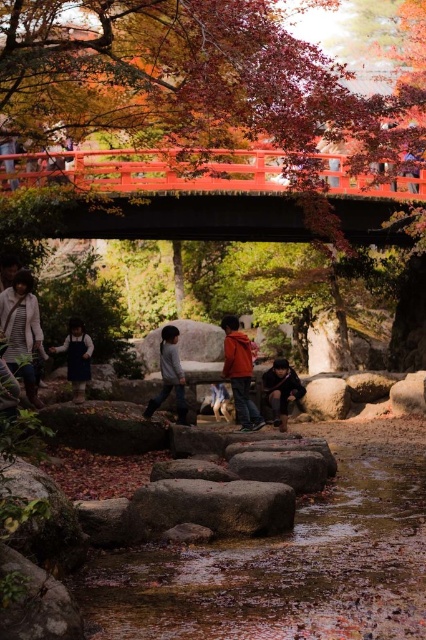
Can you confirm if smooth red bridge at upper center is smaller than dark brown leather jacket at center?

Yes.

Can you confirm if smooth red bridge at upper center is positioned below dark brown leather jacket at center?

Incorrect, smooth red bridge at upper center is not positioned below dark brown leather jacket at center.

This screenshot has width=426, height=640. Describe the element at coordinates (173, 193) in the screenshot. I see `smooth red bridge at upper center` at that location.

The image size is (426, 640). Find the location of `smooth red bridge at upper center`. smooth red bridge at upper center is located at coordinates (173, 193).

Can you confirm if red-orange hoodie at center is bigger than dark blue denim dress at center?

Indeed, red-orange hoodie at center has a larger size compared to dark blue denim dress at center.

Is the position of red-orange hoodie at center less distant than that of dark blue denim dress at center?

Yes, it is in front of dark blue denim dress at center.

Does point (241, 348) lie behind point (75, 392)?

No, it is in front of (75, 392).

Find the location of a particular element. red-orange hoodie at center is located at coordinates (239, 372).

Who is positioned more to the left, red-orange hoodie at center or smooth gray rock at center?

From the viewer's perspective, red-orange hoodie at center appears more on the left side.

Does point (233, 353) lie in front of point (348, 408)?

Yes, point (233, 353) is in front of point (348, 408).

I want to click on red-orange hoodie at center, so click(x=239, y=372).